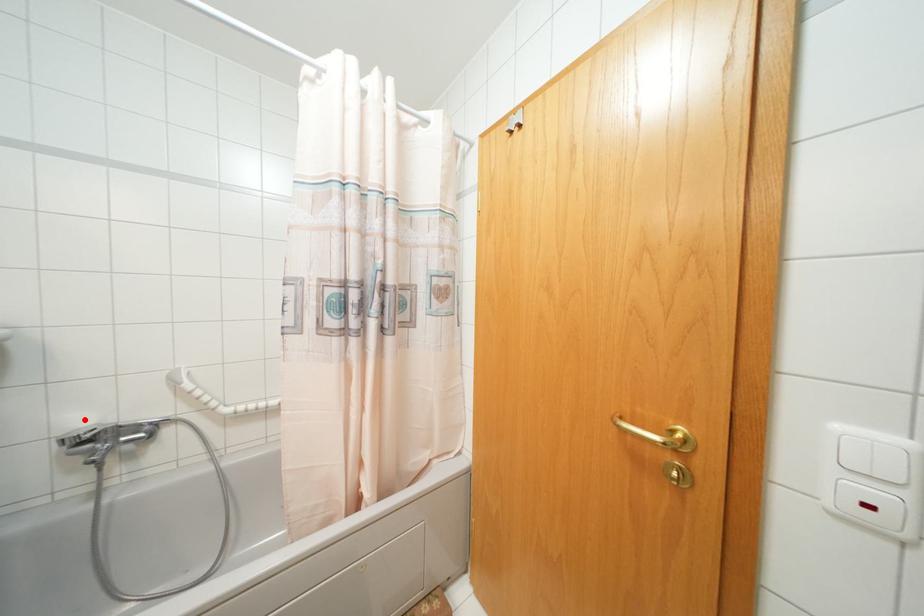
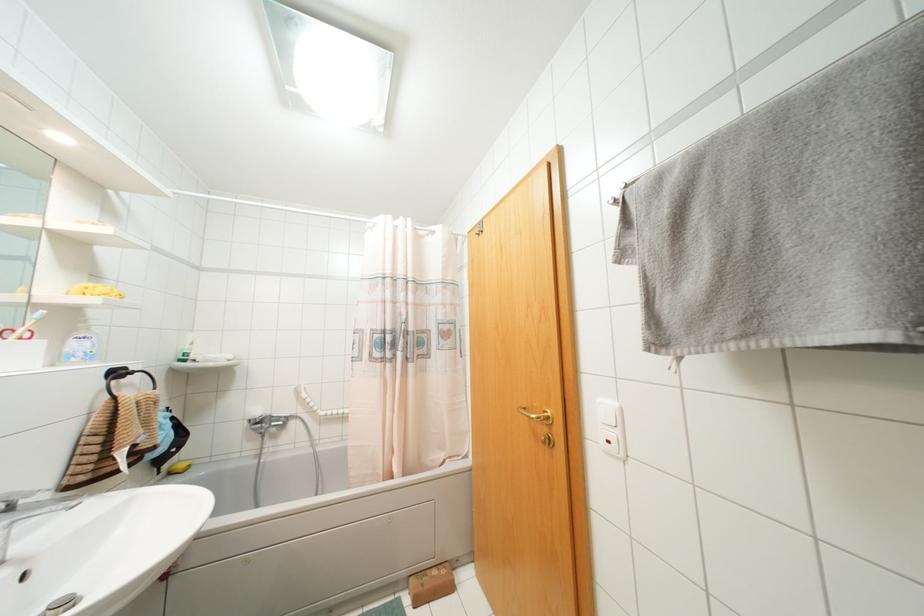
The point at the highlighted location is marked in the first image. Where is the corresponding point in the second image?

(258, 411)